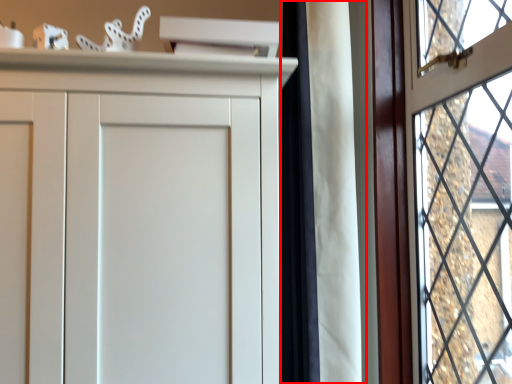
Question: From the image's perspective, what is the correct spatial positioning of curtain (annotated by the red box) in reference to window?

Choices:
 (A) above
 (B) below

Answer: (A)